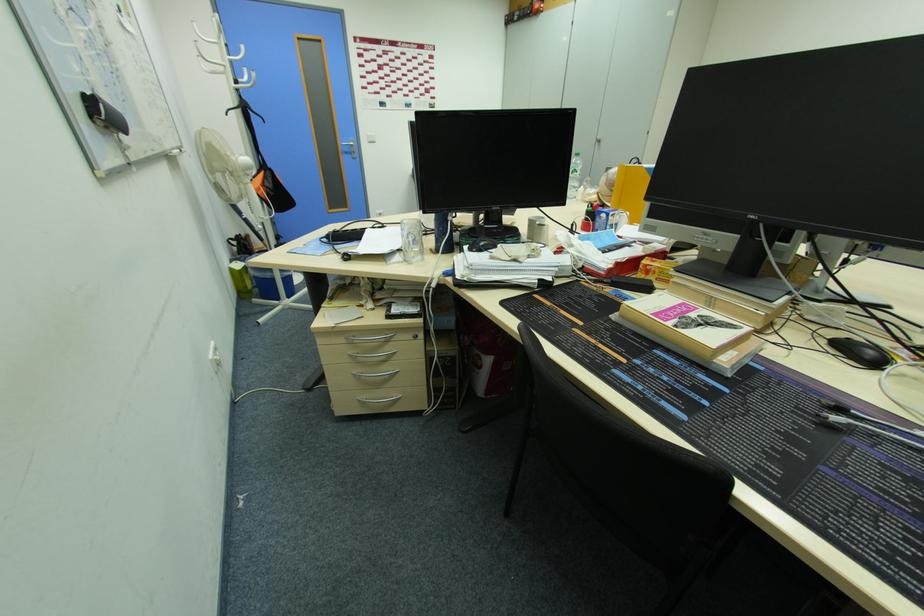
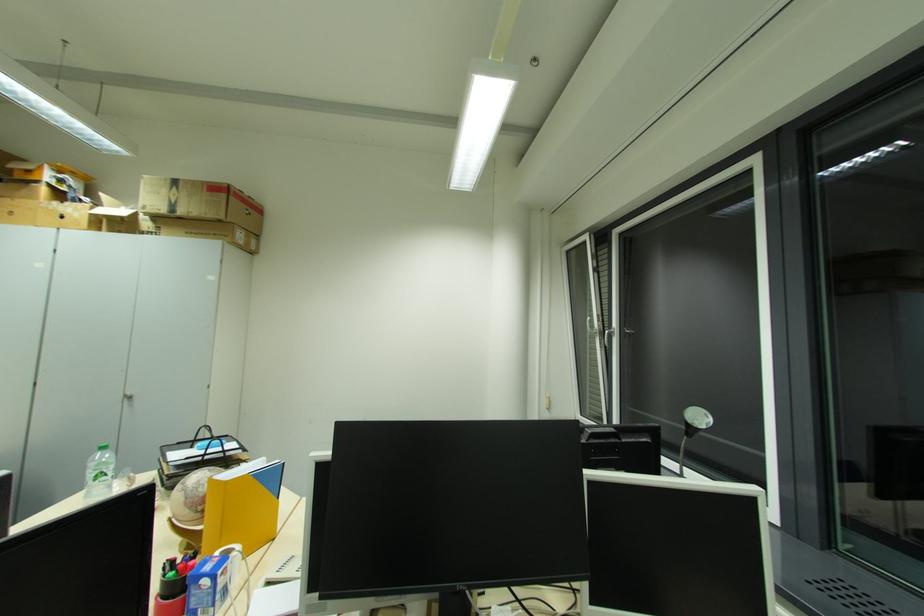
Find the pixel in the second image that matches pixel 614 219 in the first image.

(223, 582)